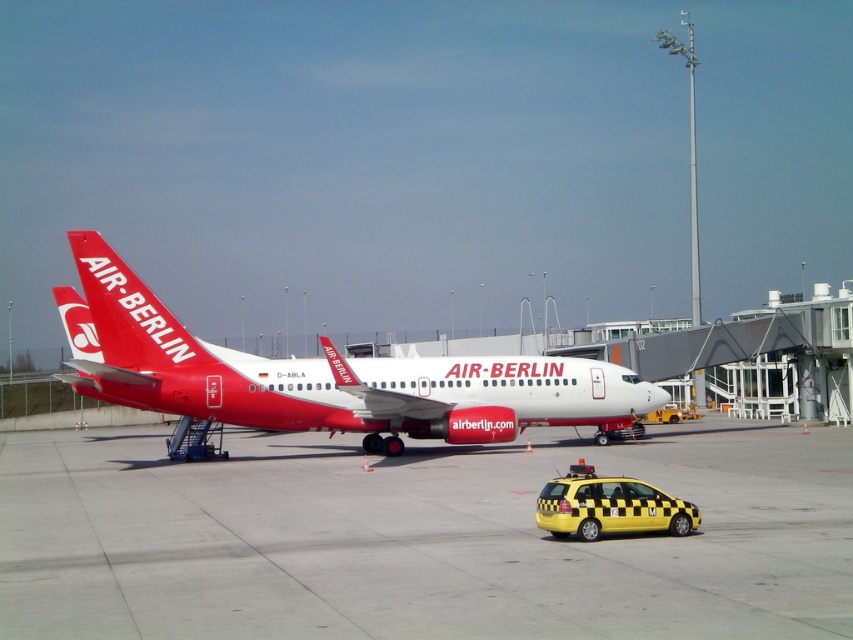
Who is shorter, matte white airplane at center or yellow checkered taxi at lower right?

Standing shorter between the two is yellow checkered taxi at lower right.

Who is more forward, (436, 432) or (561, 524)?

Positioned in front is point (561, 524).

Where is `matte white airplane at center`? matte white airplane at center is located at coordinates (323, 376).

Who is more forward, (135, 554) or (613, 525)?

Point (613, 525)

Does smooth concrete tarmac at center have a lesser height compared to yellow checkered taxi at lower right?

No, smooth concrete tarmac at center is not shorter than yellow checkered taxi at lower right.

Locate an element on the screen. This screenshot has width=853, height=640. smooth concrete tarmac at center is located at coordinates (418, 538).

Can you confirm if smooth concrete tarmac at center is positioned below matte white airplane at center?

Correct, smooth concrete tarmac at center is located below matte white airplane at center.

Is smooth concrete tarmac at center to the right of matte white airplane at center from the viewer's perspective?

Indeed, smooth concrete tarmac at center is positioned on the right side of matte white airplane at center.

Is point (202, 522) positioned in front of point (541, 376)?

Yes, point (202, 522) is closer to viewer.

Where is `smooth concrete tarmac at center`? The image size is (853, 640). smooth concrete tarmac at center is located at coordinates (418, 538).